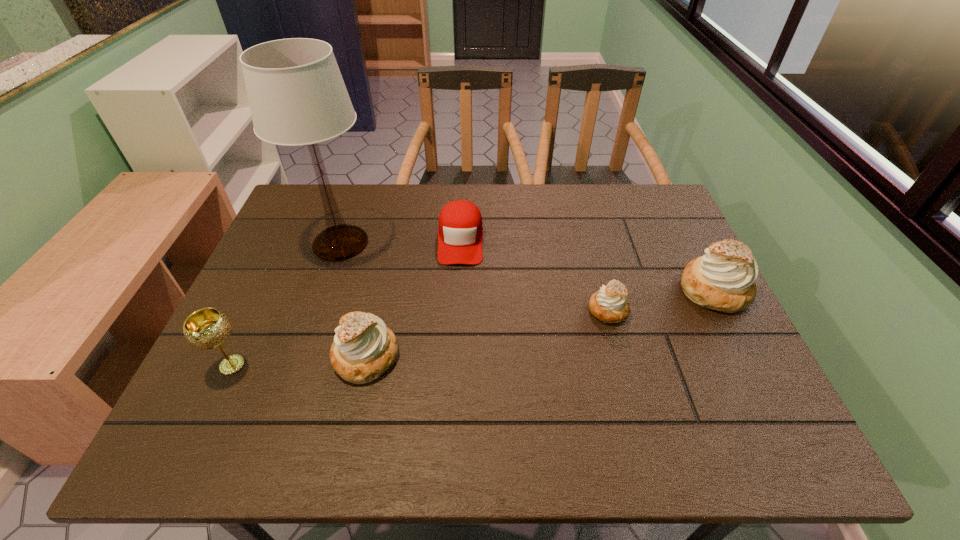
Find the location of a particular element. object positioned at the right edge is located at coordinates [x=723, y=279].

I want to click on object at the far left corner, so (297, 96).

This screenshot has width=960, height=540. I want to click on object that is positioned at the near left corner, so click(x=207, y=328).

In the image, there is a desktop. At what (x,y) coordinates should I click in order to perform the action: click on vacant space at the far edge. Please return your answer as a coordinate pair (x, y). Looking at the image, I should click on (562, 185).

Find the location of a particular element. free space at the near edge is located at coordinates (289, 378).

Image resolution: width=960 pixels, height=540 pixels. In order to click on free spot at the left edge of the desktop in this screenshot , I will do `click(293, 318)`.

Find the location of a particular element. The image size is (960, 540). vacant point at the right edge is located at coordinates (745, 367).

In the image, there is a desktop. Where is `free region at the near right corner`? The width and height of the screenshot is (960, 540). free region at the near right corner is located at coordinates (713, 398).

Where is `unoccupied position between the third object from right to left and the chalice`? The width and height of the screenshot is (960, 540). unoccupied position between the third object from right to left and the chalice is located at coordinates (347, 302).

Identify the location of free space between the tallest object and the baseball cap. pos(400,241).